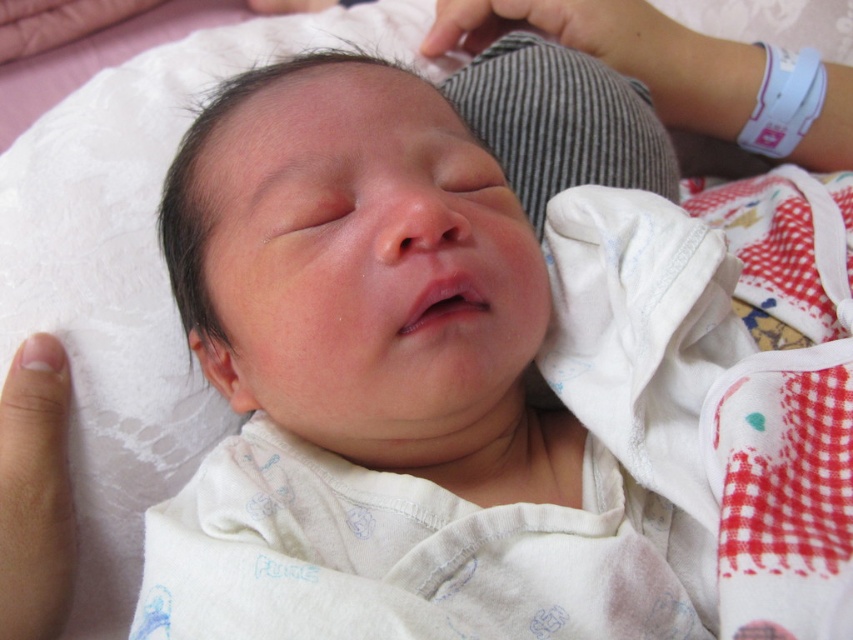
Between smooth skin newborn at center and smooth skin finger at lower left, which one appears on the right side from the viewer's perspective?

smooth skin newborn at center is more to the right.

Does smooth skin newborn at center have a larger size compared to smooth skin finger at lower left?

Yes, smooth skin newborn at center is bigger than smooth skin finger at lower left.

Which is behind, point (164, 227) or point (30, 454)?

Positioned behind is point (30, 454).

You are a GUI agent. You are given a task and a screenshot of the screen. Output one action in this format:
    pyautogui.click(x=<x>, y=<y>)
    Task: Click on the smooth skin newborn at center
    This screenshot has width=853, height=640.
    Given the screenshot: What is the action you would take?
    pyautogui.click(x=430, y=381)